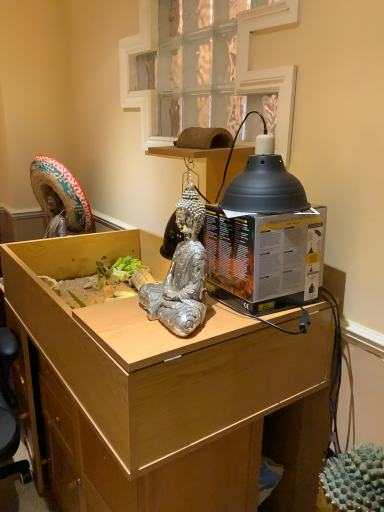
Question: Considering the relative positions of black matte lampshade at upper right and black cardboard box at right in the image provided, is black matte lampshade at upper right to the right of black cardboard box at right from the viewer's perspective?

Choices:
 (A) yes
 (B) no

Answer: (A)

Question: From the image's perspective, is black matte lampshade at upper right located beneath black cardboard box at right?

Choices:
 (A) no
 (B) yes

Answer: (A)

Question: Considering the relative sizes of black matte lampshade at upper right and black cardboard box at right in the image provided, is black matte lampshade at upper right wider than black cardboard box at right?

Choices:
 (A) yes
 (B) no

Answer: (B)

Question: Is the depth of black matte lampshade at upper right greater than that of black cardboard box at right?

Choices:
 (A) no
 (B) yes

Answer: (A)

Question: Are black matte lampshade at upper right and black cardboard box at right far apart?

Choices:
 (A) no
 (B) yes

Answer: (A)

Question: Choose the correct answer: Is black matte lampshade at upper right inside light wood desk at center or outside it?

Choices:
 (A) inside
 (B) outside

Answer: (B)

Question: Considering the relative positions of black matte lampshade at upper right and light wood desk at center in the image provided, is black matte lampshade at upper right to the left or to the right of light wood desk at center?

Choices:
 (A) left
 (B) right

Answer: (B)

Question: Looking at their shapes, would you say black matte lampshade at upper right is wider or thinner than light wood desk at center?

Choices:
 (A) thin
 (B) wide

Answer: (A)

Question: Does point (301, 200) appear closer or farther from the camera than point (157, 438)?

Choices:
 (A) farther
 (B) closer

Answer: (A)

Question: Does point (221, 182) appear closer or farther from the camera than point (142, 117)?

Choices:
 (A) closer
 (B) farther

Answer: (A)

Question: Considering the positions of black matte lampshade at upper right and clear glass window at upper center in the image, is black matte lampshade at upper right wider or thinner than clear glass window at upper center?

Choices:
 (A) wide
 (B) thin

Answer: (A)

Question: From their relative heights in the image, would you say black matte lampshade at upper right is taller or shorter than clear glass window at upper center?

Choices:
 (A) tall
 (B) short

Answer: (B)

Question: Choose the correct answer: Is black matte lampshade at upper right inside clear glass window at upper center or outside it?

Choices:
 (A) outside
 (B) inside

Answer: (A)

Question: From the image's perspective, is light wood desk at center above or below silver metallic statue at center?

Choices:
 (A) below
 (B) above

Answer: (A)

Question: Would you say light wood desk at center is to the left or to the right of silver metallic statue at center in the picture?

Choices:
 (A) left
 (B) right

Answer: (A)